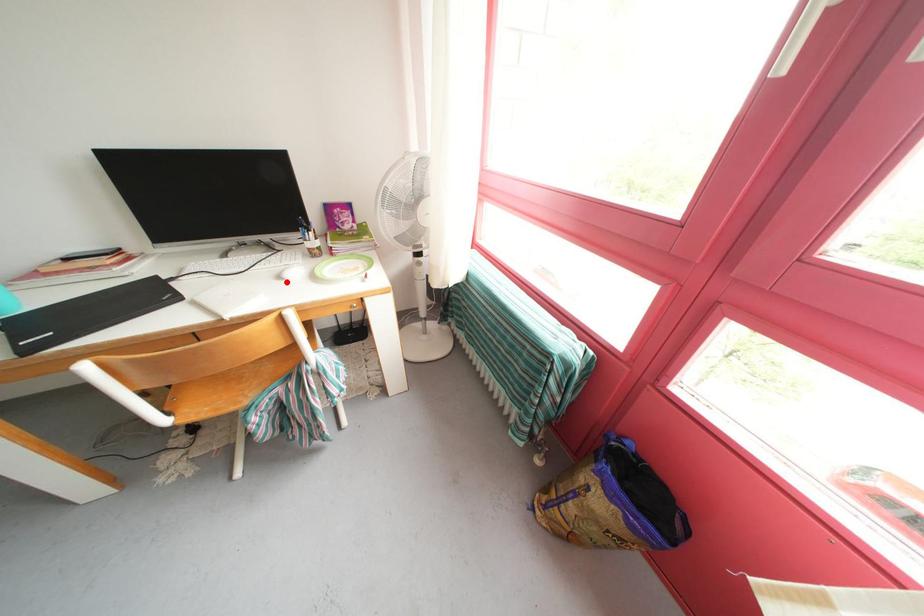
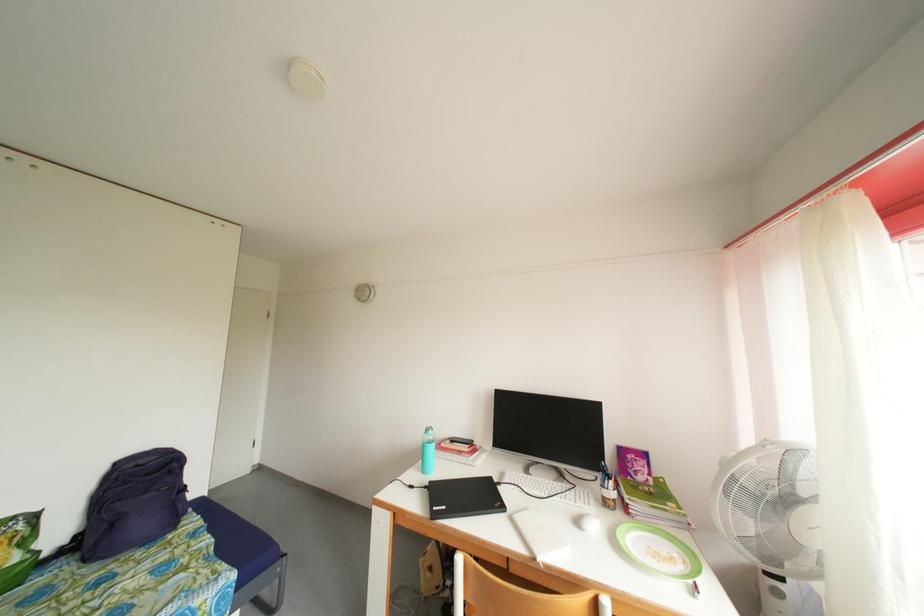
Find the pixel in the second image that matches the highlighted location in the first image.

(585, 528)